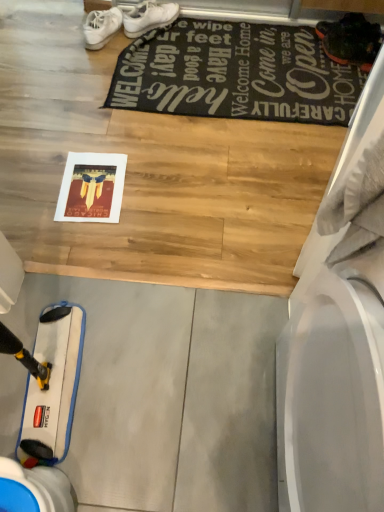
I want to click on vacant area to the left of black fabric mat at upper center, so click(x=46, y=76).